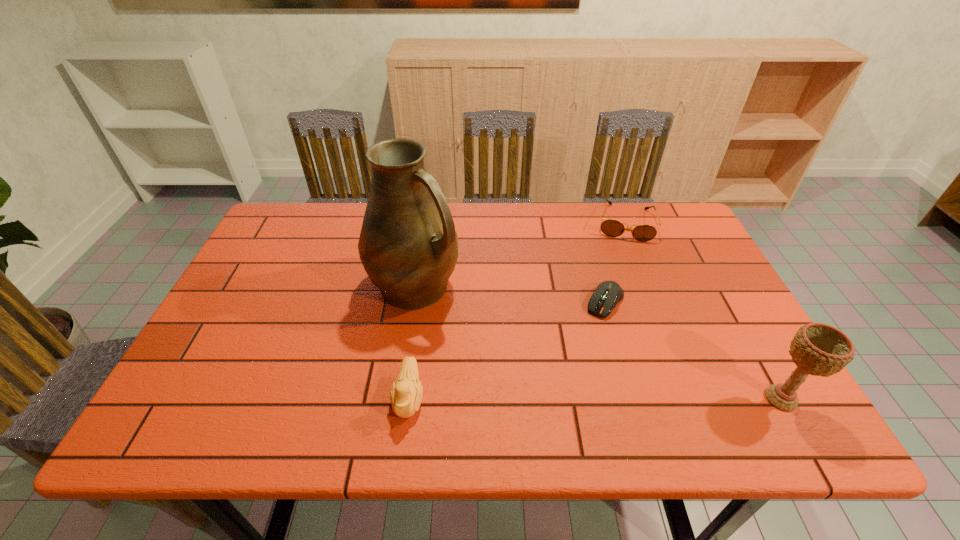
This screenshot has width=960, height=540. I want to click on the third tallest object, so click(x=405, y=395).

Identify the location of the rightmost object. (819, 349).

I want to click on the fourth shortest object, so click(819, 349).

Image resolution: width=960 pixels, height=540 pixels. Find the location of `pitcher`. pitcher is located at coordinates (408, 246).

Identify the location of computer equipment. pos(607,294).

The width and height of the screenshot is (960, 540). I want to click on the farthest object, so click(612, 228).

What are the coordinates of `sunglasses` in the screenshot? It's located at (612, 228).

At what (x,y) coordinates should I click in order to perform the action: click on free point located on the back of the chalice. Please return your answer as a coordinate pair (x, y). This screenshot has width=960, height=540. Looking at the image, I should click on (748, 341).

What are the coordinates of `free space located on the handle side of the pitcher` in the screenshot? It's located at (552, 382).

Identify the location of free space located on the handle side of the pitcher. (493, 341).